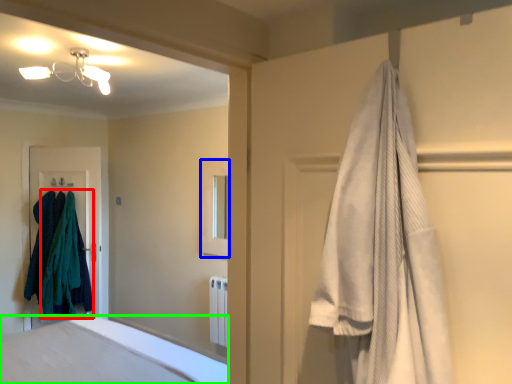
Question: Estimate the real-world distances between objects in this image. Which object is closer to clothing (highlighted by a red box), medicine cabinet (highlighted by a blue box) or bathtub (highlighted by a green box)?

Choices:
 (A) medicine cabinet
 (B) bathtub

Answer: (A)